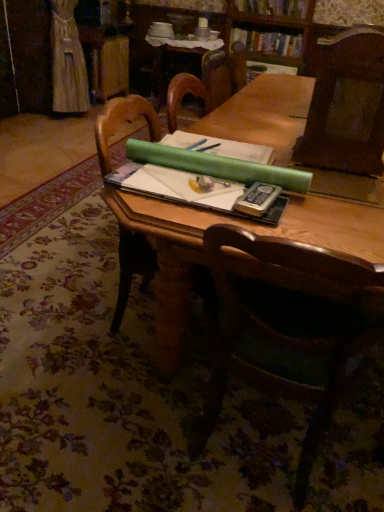
This screenshot has height=512, width=384. I want to click on free spot in front of wooden table at center, so click(x=126, y=398).